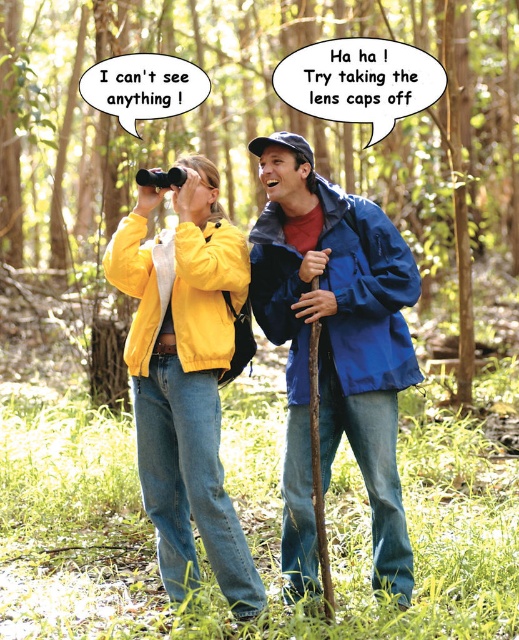
Question: Is the position of green matte forest at center less distant than that of blue waterproof jacket at center?

Choices:
 (A) no
 (B) yes

Answer: (A)

Question: Which point is closer to the camera taking this photo?

Choices:
 (A) (185, 387)
 (B) (40, 124)

Answer: (A)

Question: Among these objects, which one is farthest from the camera?

Choices:
 (A) blue waterproof jacket at center
 (B) matte yellow jacket at center
 (C) green matte forest at center

Answer: (C)

Question: Which of the following is the farthest from the observer?

Choices:
 (A) green matte forest at center
 (B) matte yellow jacket at center

Answer: (A)

Question: Is blue waterproof jacket at center bigger than matte yellow jacket at center?

Choices:
 (A) no
 (B) yes

Answer: (A)

Question: Does green matte forest at center have a larger size compared to matte yellow jacket at center?

Choices:
 (A) no
 (B) yes

Answer: (B)